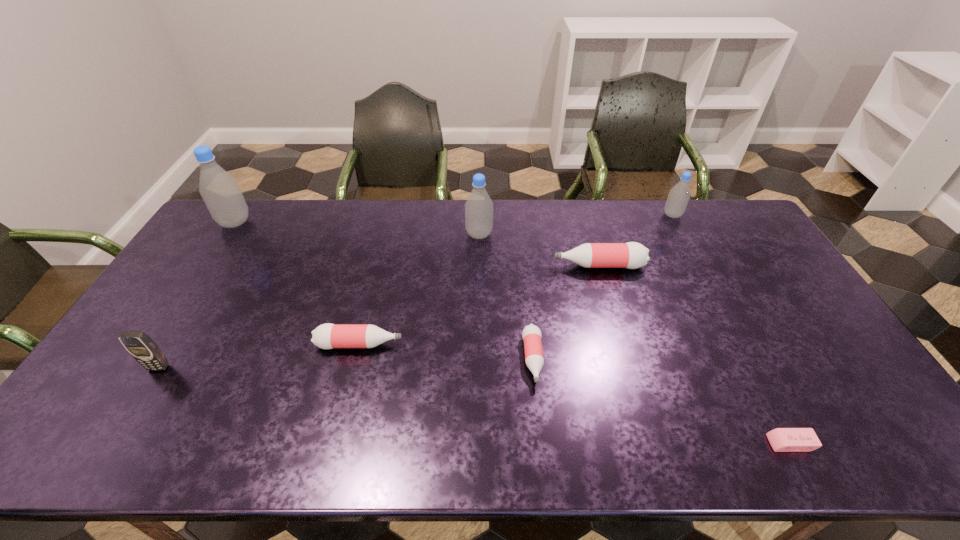
The height and width of the screenshot is (540, 960). In order to click on the biggest gray bottle in this screenshot , I will do `click(220, 191)`.

In order to click on the tallest object in this screenshot , I will do `click(220, 191)`.

This screenshot has width=960, height=540. Identify the location of the second biggest gray bottle. (479, 207).

You are a GUI agent. You are given a task and a screenshot of the screen. Output one action in this format:
    pyautogui.click(x=<x>, y=<y>)
    Task: Click on the third bottle from left to right
    This screenshot has height=540, width=960.
    Given the screenshot: What is the action you would take?
    pyautogui.click(x=479, y=207)

Identify the location of the smallest gray bottle. This screenshot has height=540, width=960. (678, 198).

Where is `the sixth shortest object`? Image resolution: width=960 pixels, height=540 pixels. the sixth shortest object is located at coordinates (678, 198).

Where is `the fourth tallest object`? the fourth tallest object is located at coordinates (144, 350).

Locate an element on the screen. the fourth shortest object is located at coordinates coord(631,255).

Where is `the fourth farthest object`? Image resolution: width=960 pixels, height=540 pixels. the fourth farthest object is located at coordinates (631, 255).

The width and height of the screenshot is (960, 540). Find the location of `the sixth tallest object`. the sixth tallest object is located at coordinates (326, 336).